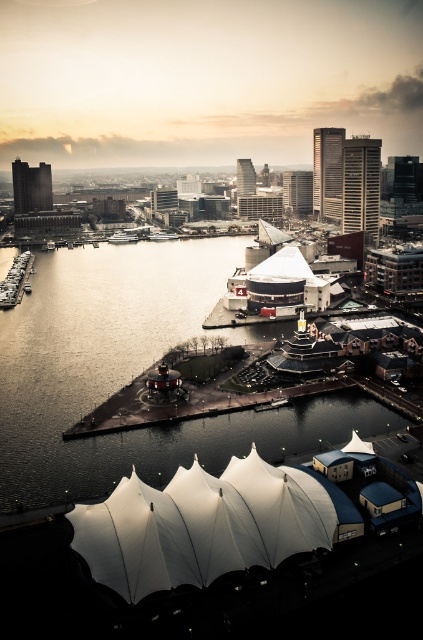
Question: Which object is the closest to the silvery water at center?

Choices:
 (A) white fabric canopy at center
 (B) white fabric umbrella at lower center

Answer: (B)

Question: Among these points, which one is nearest to the camera?

Choices:
 (A) (353, 440)
 (B) (164, 451)

Answer: (A)

Question: Is silvery water at center below white fabric canopy at center?

Choices:
 (A) no
 (B) yes

Answer: (A)

Question: Considering the relative positions of white fabric umbrella at lower center and white fabric canopy at center in the image provided, where is white fabric umbrella at lower center located with respect to white fabric canopy at center?

Choices:
 (A) above
 (B) below

Answer: (B)

Question: Which point is farther to the camera?

Choices:
 (A) silvery water at center
 (B) white fabric umbrella at lower center

Answer: (A)

Question: Can you confirm if silvery water at center is smaller than white fabric umbrella at lower center?

Choices:
 (A) no
 (B) yes

Answer: (A)